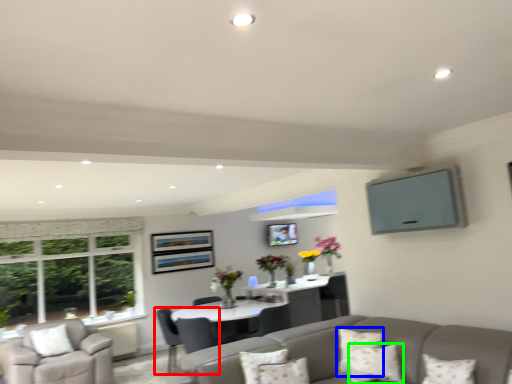
Question: Which object is the closest to the chair (highlighted by a red box)? Choose among these: pillow (highlighted by a blue box) or pillow (highlighted by a green box).

Choices:
 (A) pillow
 (B) pillow

Answer: (A)